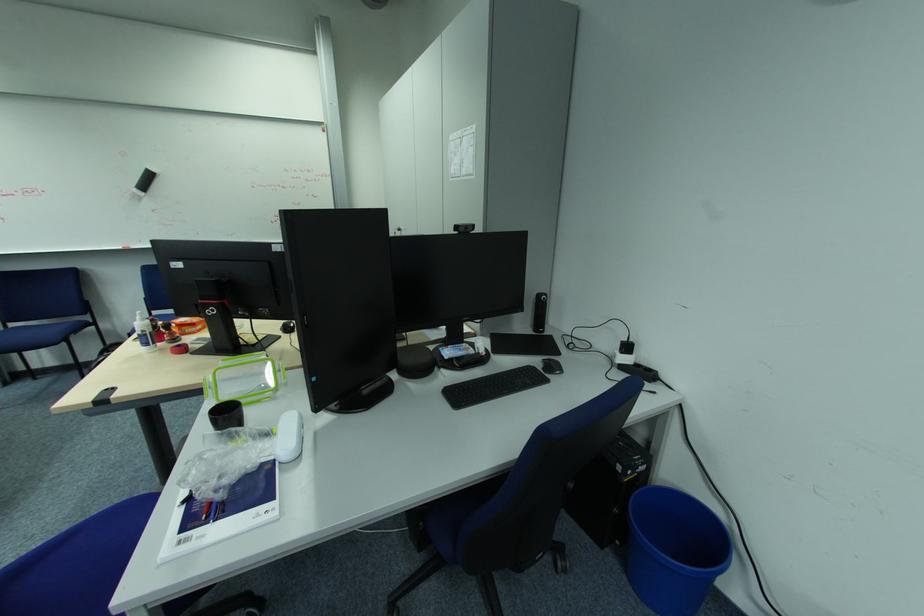
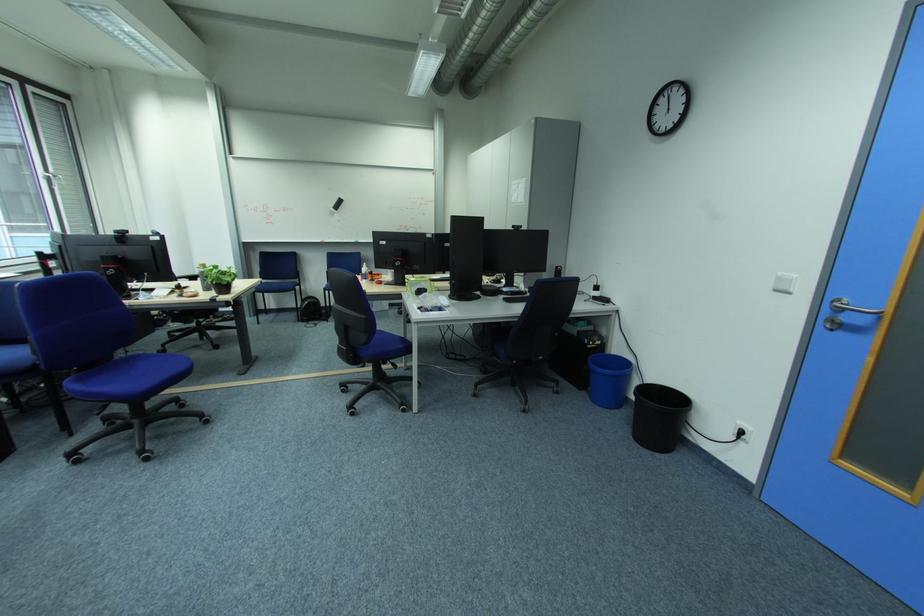
Question: I am providing you with two images of the same scene from different viewpoints. Which of the following objects are not visible in image2?

Choices:
 (A) white light switch
 (B) small plant pot
 (C) silver door handle
 (D) none of these

Answer: (D)